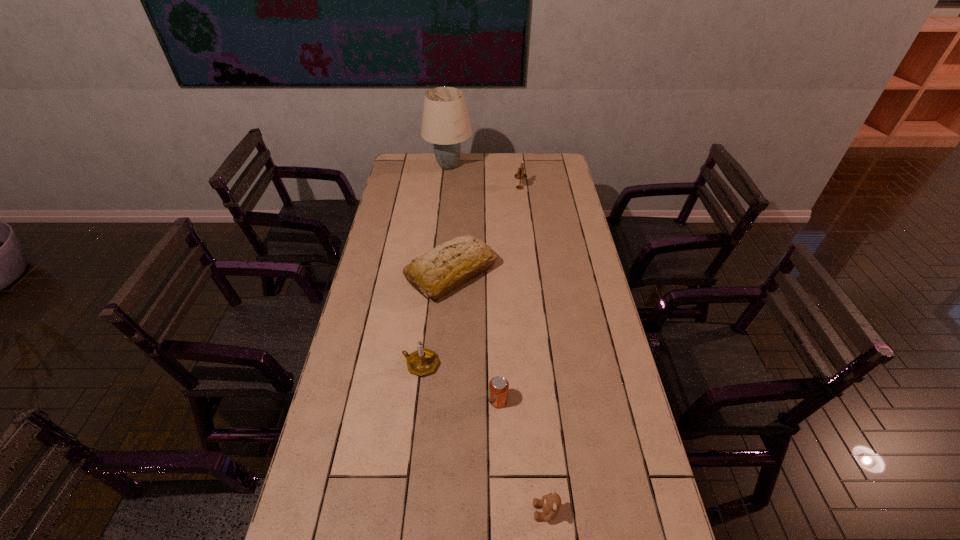
The image size is (960, 540). I want to click on vacant space situated 0.350m on the front of the second farthest object, so click(526, 237).

Find the location of a particular element. Image resolution: width=960 pixels, height=540 pixels. free space located 0.340m on the back of the bread is located at coordinates (457, 199).

Locate an element on the screen. Image resolution: width=960 pixels, height=540 pixels. free space located 0.340m on the right of the third nearest object is located at coordinates (545, 364).

You are a GUI agent. You are given a task and a screenshot of the screen. Output one action in this format:
    pyautogui.click(x=<x>, y=<y>)
    Task: Click on the free space located 0.180m on the front of the can
    This screenshot has height=540, width=960.
    Given the screenshot: What is the action you would take?
    pyautogui.click(x=500, y=470)

Where is `vacant space located 0.320m on the face of the nearest object`? This screenshot has height=540, width=960. vacant space located 0.320m on the face of the nearest object is located at coordinates (404, 511).

The width and height of the screenshot is (960, 540). Identify the location of vacant space situated on the face of the nearest object. (444, 511).

Identify the location of vacant area located 0.300m on the face of the nearest object. The height and width of the screenshot is (540, 960). (413, 511).

I want to click on object that is positioned at the far edge, so click(445, 122).

Identify the location of lampshade that is at the left edge. (445, 122).

The width and height of the screenshot is (960, 540). Identify the location of bread present at the left edge. (448, 266).